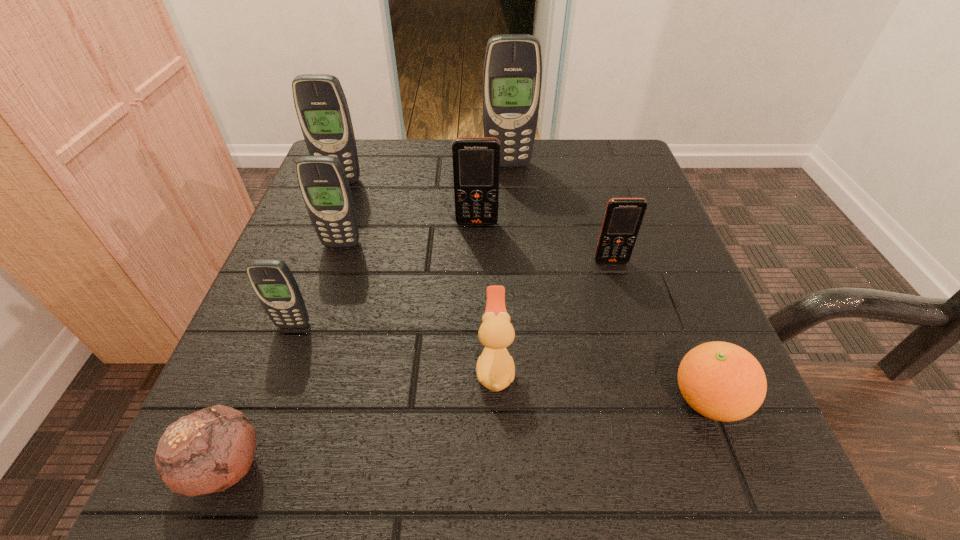
Find the location of a particular element. The height and width of the screenshot is (540, 960). vacant position located 0.050m on the screen of the nearest gray cellular telephone is located at coordinates (282, 356).

This screenshot has height=540, width=960. Identify the location of vacant space positioned 0.170m on the beak of the tan duck. (357, 367).

I want to click on vacant point located 0.070m on the beak of the tan duck, so click(x=427, y=367).

Identify the location of vacant space located 0.070m on the beak of the tan duck. This screenshot has width=960, height=540. (427, 367).

Locate an element on the screen. The width and height of the screenshot is (960, 540). vacant area situated 0.170m on the left of the orange is located at coordinates (543, 400).

The height and width of the screenshot is (540, 960). Identify the location of vacant space located 0.250m on the right of the muffin. (474, 467).

You are a GUI agent. You are given a task and a screenshot of the screen. Output one action in this format:
    pyautogui.click(x=<x>, y=<y>)
    Task: Click on the orange that is at the near edge
    The width and height of the screenshot is (960, 540).
    Given the screenshot: What is the action you would take?
    pyautogui.click(x=722, y=381)

Find the location of a particular element. The width and height of the screenshot is (960, 540). muffin that is at the near edge is located at coordinates (208, 451).

Locate an element on the screen. Image resolution: width=960 pixels, height=540 pixels. muffin that is at the left edge is located at coordinates (208, 451).

The height and width of the screenshot is (540, 960). I want to click on cellular telephone at the right edge, so click(x=623, y=217).